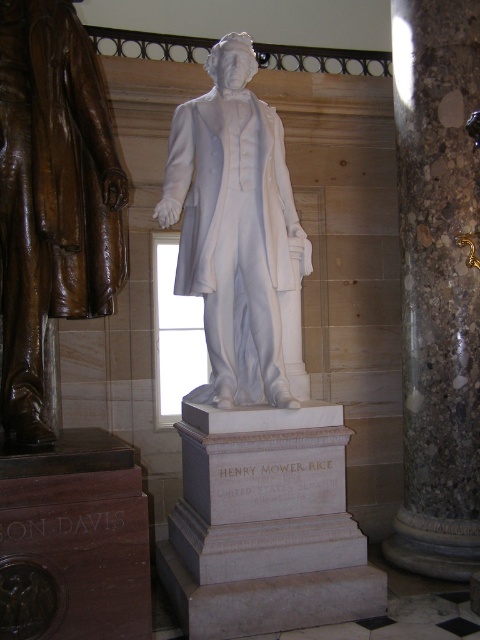
You are standing in front of the statue of Henry Mower Rice in the formal building. There are two points marked on the statue base. The first point is at coordinate (28, 307) and the second is at (272, 112). Which point is closer to you?

Point (28, 307) is closer to the viewer than point (272, 112).

Consider the image. You are standing at the center of the room facing the statue of Henry Mower Rice. If you turn 90 degrees to your right, will you face the marble column at right?

The marble column at right is located at point (437,285). Since you are facing the statue, turning 90 degrees to your right would face you towards the right side of the room. The marble column at right is indeed positioned on the right side, so yes, turning 90 degrees to your right would face you toward the marble column at right.